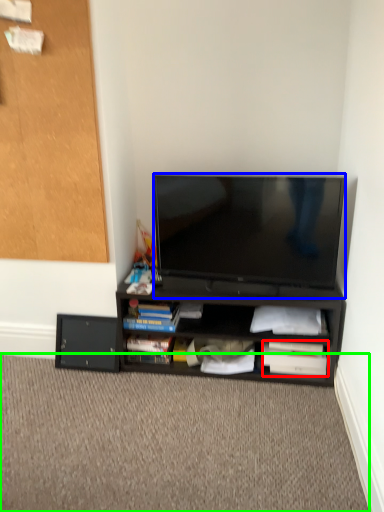
Question: Estimate the real-world distances between objects in this image. Which object is closer to paperback book (highlighted by a red box), television (highlighted by a blue box) or plain (highlighted by a green box)?

Choices:
 (A) television
 (B) plain

Answer: (B)